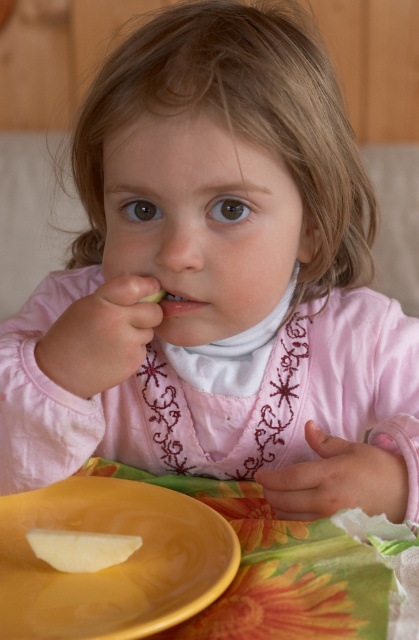
Question: Can you confirm if yellow matte plate at lower left is thinner than white matte apple slice at lower left?

Choices:
 (A) no
 (B) yes

Answer: (A)

Question: Does white matte apple slice at lower left have a smaller size compared to matte pink lips at center?

Choices:
 (A) no
 (B) yes

Answer: (A)

Question: Which object is farther from the camera taking this photo?

Choices:
 (A) white matte apple slice at lower left
 (B) matte pink lips at center
 (C) yellow matte plate at lower left

Answer: (B)

Question: Can you confirm if white matte apple slice at lower left is positioned to the right of matte pink lips at center?

Choices:
 (A) no
 (B) yes

Answer: (A)

Question: Which is farther from the yellow matte plate at lower left?

Choices:
 (A) white matte apple slice at lower left
 (B) matte pink lips at center

Answer: (B)

Question: Which object is positioned farthest from the yellow matte plate at lower left?

Choices:
 (A) matte pink lips at center
 (B) white matte apple slice at lower left

Answer: (A)